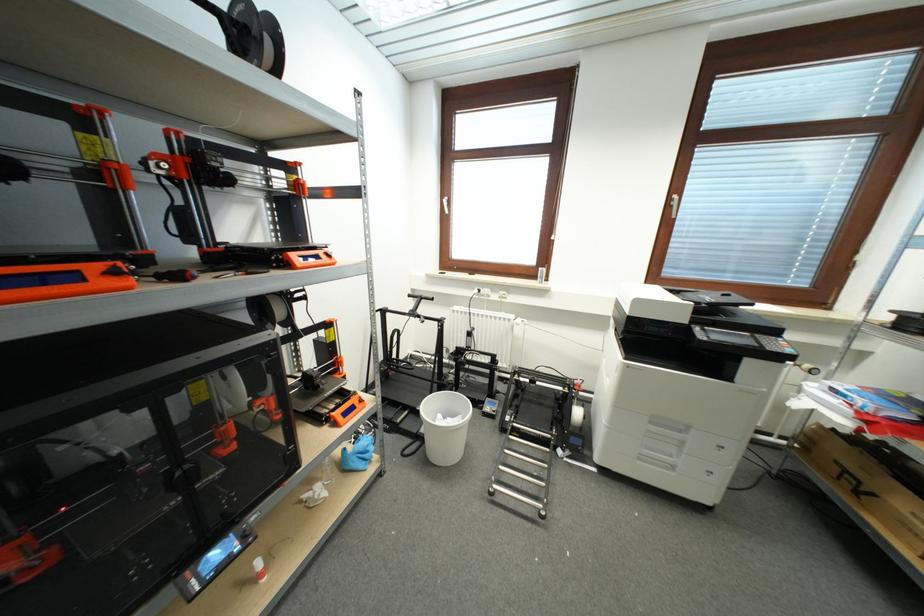
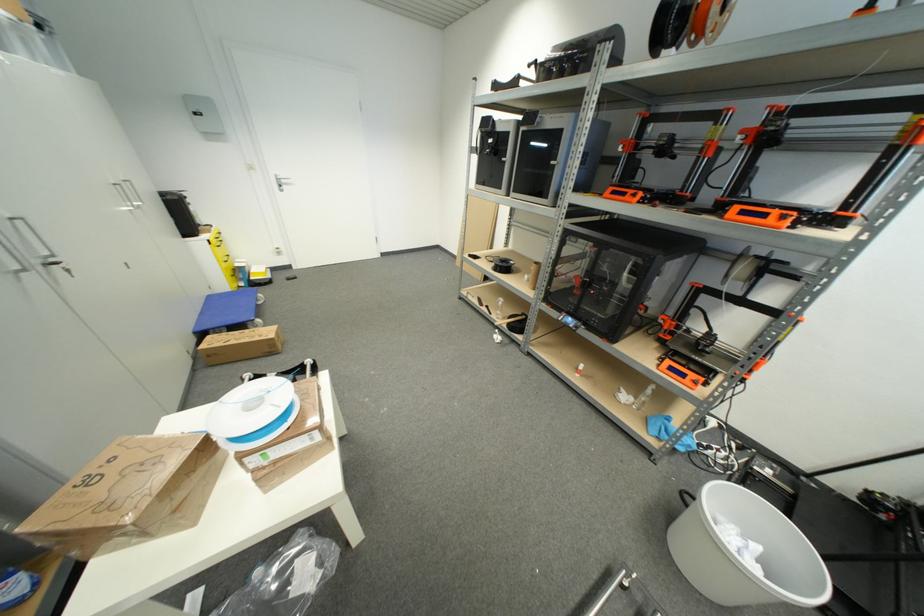
In the second image, find the point that corresponds to point (350, 416) in the first image.

(675, 371)